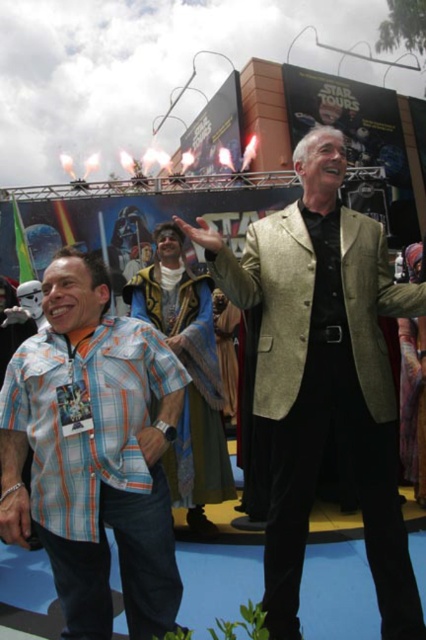
Question: Is gold textured coat at center further to the viewer compared to velvet blue robe at center?

Choices:
 (A) yes
 (B) no

Answer: (B)

Question: Can you confirm if gold textured coat at center is wider than velvet blue robe at center?

Choices:
 (A) yes
 (B) no

Answer: (A)

Question: Which point is closer to the camera?

Choices:
 (A) velvet blue robe at center
 (B) plaid cotton shirt at left
 (C) gold textured coat at center

Answer: (C)

Question: Which of these objects is positioned closest to the gold textured coat at center?

Choices:
 (A) velvet blue robe at center
 (B) plaid cotton shirt at left

Answer: (A)

Question: Which of the following is the closest to the observer?

Choices:
 (A) plaid cotton shirt at left
 (B) velvet blue robe at center
 (C) gold textured coat at center

Answer: (C)

Question: Does gold textured coat at center have a smaller size compared to velvet blue robe at center?

Choices:
 (A) yes
 (B) no

Answer: (B)